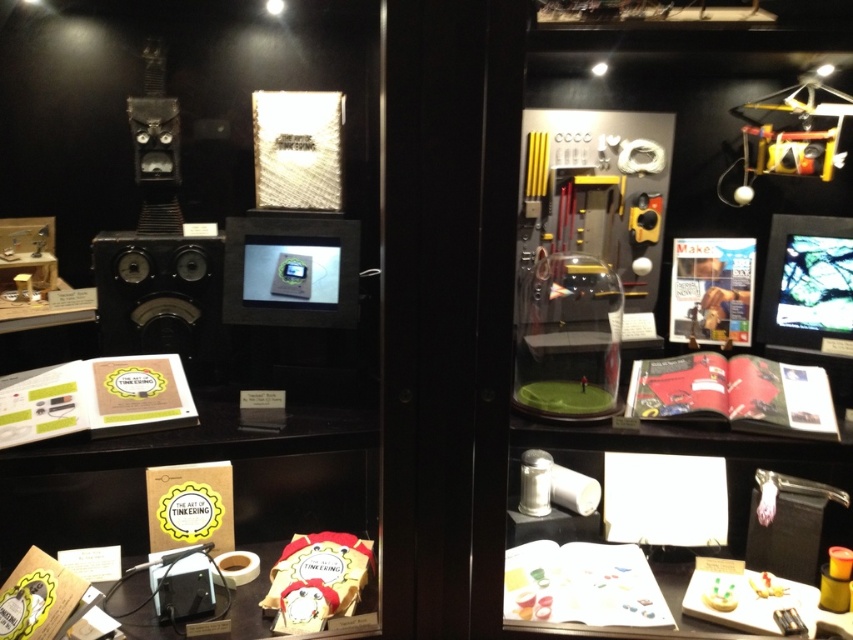
Is point (119, 328) positioned after point (757, 128)?

No, it is in front of (757, 128).

Does matte black speaker at left appear on the right side of metallic yellow helicopter at upper right?

No, matte black speaker at left is not to the right of metallic yellow helicopter at upper right.

This screenshot has width=853, height=640. Find the location of `matte black speaker at left`. matte black speaker at left is located at coordinates (161, 298).

Is clear glass dome at center bigger than matte black speaker at left?

Indeed, clear glass dome at center has a larger size compared to matte black speaker at left.

Which is in front, point (482, 474) or point (166, 292)?

Point (482, 474) is in front.

Where is `clear glass dome at center`? The height and width of the screenshot is (640, 853). clear glass dome at center is located at coordinates (585, 257).

Which is more to the left, clear glass dome at center or metallic yellow helicopter at upper right?

clear glass dome at center is more to the left.

Looking at this image, can you confirm if clear glass dome at center is bigger than metallic yellow helicopter at upper right?

Yes, clear glass dome at center is bigger than metallic yellow helicopter at upper right.

Does point (498, 61) come closer to viewer compared to point (810, 109)?

That is True.

The height and width of the screenshot is (640, 853). Find the location of `clear glass dome at center`. clear glass dome at center is located at coordinates (585, 257).